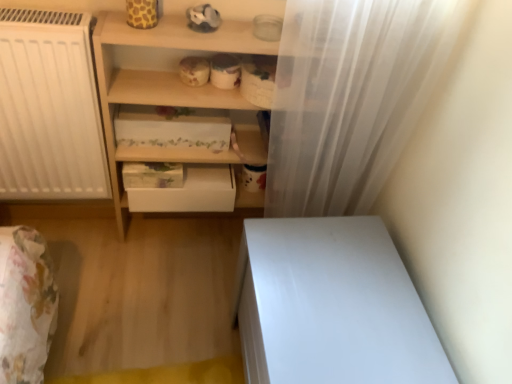
Question: Is white matte drawer at center situated inside white glossy vanity at lower right or outside?

Choices:
 (A) outside
 (B) inside

Answer: (A)

Question: Considering the positions of white matte drawer at center and white glossy vanity at lower right in the image, is white matte drawer at center bigger or smaller than white glossy vanity at lower right?

Choices:
 (A) big
 (B) small

Answer: (B)

Question: Which object is the farthest from the white matte drawer at center?

Choices:
 (A) white sheer curtain at right
 (B) white floral-patterned drawer at center, positioned as the first shelf in top-to-bottom order
 (C) white glossy vanity at lower right
 (D) wooden shelf at center, positioned as the 1th shelf in bottom-to-top order

Answer: (C)

Question: Estimate the real-world distances between objects in this image. Which object is closer to the white floral-patterned drawer at center, positioned as the first shelf in top-to-bottom order?

Choices:
 (A) white sheer curtain at right
 (B) white glossy vanity at lower right
 (C) wooden shelf at center, positioned as the 1th shelf in bottom-to-top order
 (D) white matte drawer at center

Answer: (C)